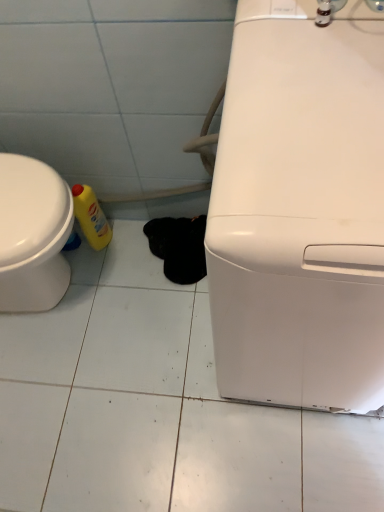
Where is `yellow plastic bottle at lower left`? Image resolution: width=384 pixels, height=512 pixels. yellow plastic bottle at lower left is located at coordinates (91, 217).

What do you see at coordinates (91, 217) in the screenshot? I see `yellow plastic bottle at lower left` at bounding box center [91, 217].

What is the approximate height of yellow plastic bottle at lower left?

yellow plastic bottle at lower left is 11.90 inches tall.

In order to click on white glossy washing machine at right in this screenshot , I will do `click(300, 214)`.

What do you see at coordinates (300, 214) in the screenshot? This screenshot has width=384, height=512. I see `white glossy washing machine at right` at bounding box center [300, 214].

Image resolution: width=384 pixels, height=512 pixels. In order to click on yellow plastic bottle at lower left in this screenshot , I will do `click(91, 217)`.

Is white glossy washing machine at right at the left side of yellow plastic bottle at lower left?

Incorrect, white glossy washing machine at right is not on the left side of yellow plastic bottle at lower left.

Is white glossy washing machine at right positioned behind yellow plastic bottle at lower left?

No, white glossy washing machine at right is closer to the viewer.

Between point (333, 406) and point (105, 232), which one is positioned behind?

The point (105, 232) is farther from the camera.

Based on the photo, from the image's perspective, does white glossy washing machine at right appear higher than yellow plastic bottle at lower left?

Incorrect, from the image's perspective, white glossy washing machine at right is lower than yellow plastic bottle at lower left.

From a real-world perspective, is white glossy washing machine at right positioned under yellow plastic bottle at lower left based on gravity?

No, from a real-world perspective, white glossy washing machine at right is not beneath yellow plastic bottle at lower left.

In terms of width, does white glossy washing machine at right look wider or thinner when compared to yellow plastic bottle at lower left?

white glossy washing machine at right is wider than yellow plastic bottle at lower left.

Considering the sizes of objects white glossy washing machine at right and yellow plastic bottle at lower left in the image provided, who is taller, white glossy washing machine at right or yellow plastic bottle at lower left?

white glossy washing machine at right.

In terms of size, does white glossy washing machine at right appear bigger or smaller than yellow plastic bottle at lower left?

Considering their sizes, white glossy washing machine at right takes up more space than yellow plastic bottle at lower left.

In the scene shown: Is white glossy washing machine at right inside the boundaries of yellow plastic bottle at lower left, or outside?

white glossy washing machine at right exists outside the volume of yellow plastic bottle at lower left.

Is white glossy washing machine at right not close to yellow plastic bottle at lower left?

white glossy washing machine at right is near yellow plastic bottle at lower left, not far away.

Looking at this image, is white glossy washing machine at right positioned with its back to yellow plastic bottle at lower left?

No, white glossy washing machine at right is not facing the opposite direction of yellow plastic bottle at lower left.

Can you tell me how much white glossy washing machine at right and yellow plastic bottle at lower left differ in facing direction?

They differ by 92.4 degrees in their facing directions.

Identify the location of bottle that is above the white glossy washing machine at right (from the image's perspective). This screenshot has height=512, width=384. (91, 217).

Based on their positions, is yellow plastic bottle at lower left located to the left or right of white glossy washing machine at right?

Based on their positions, yellow plastic bottle at lower left is located to the left of white glossy washing machine at right.

Considering the relative positions of yellow plastic bottle at lower left and white glossy washing machine at right in the image provided, is yellow plastic bottle at lower left behind white glossy washing machine at right?

Yes, it is behind white glossy washing machine at right.

Considering the points (85, 213) and (337, 99), which point is in front, point (85, 213) or point (337, 99)?

The point (337, 99) is more forward.

From the image's perspective, is yellow plastic bottle at lower left located above or below white glossy washing machine at right?

yellow plastic bottle at lower left is situated higher than white glossy washing machine at right in the image.

Looking at this image, from a real-world perspective, is yellow plastic bottle at lower left on top of white glossy washing machine at right?

Incorrect, from a real-world perspective, yellow plastic bottle at lower left is lower than white glossy washing machine at right.

Which object is thinner, yellow plastic bottle at lower left or white glossy washing machine at right?

yellow plastic bottle at lower left is thinner.

Does yellow plastic bottle at lower left have a greater height compared to white glossy washing machine at right?

No.

Considering the relative sizes of yellow plastic bottle at lower left and white glossy washing machine at right in the image provided, is yellow plastic bottle at lower left bigger than white glossy washing machine at right?

Actually, yellow plastic bottle at lower left might be smaller than white glossy washing machine at right.

Is yellow plastic bottle at lower left completely or partially outside of white glossy washing machine at right?

Indeed, yellow plastic bottle at lower left is completely outside white glossy washing machine at right.

Is yellow plastic bottle at lower left far from white glossy washing machine at right?

No, yellow plastic bottle at lower left is in close proximity to white glossy washing machine at right.

Is white glossy washing machine at right at the back of yellow plastic bottle at lower left?

yellow plastic bottle at lower left is not turned away from white glossy washing machine at right.

Consider the image. What's the angular difference between yellow plastic bottle at lower left and white glossy washing machine at right's facing directions?

They differ by 92.4 degrees in their facing directions.

In order to click on home appliance located above the yellow plastic bottle at lower left (from a real-world perspective) in this screenshot , I will do `click(300, 214)`.

Locate an element on the screen. The width and height of the screenshot is (384, 512). bottle above the white glossy washing machine at right (from the image's perspective) is located at coordinates (91, 217).

The height and width of the screenshot is (512, 384). In the image, there is a white glossy washing machine at right. What are the coordinates of `bottle below it (from a real-world perspective)` in the screenshot? It's located at (91, 217).